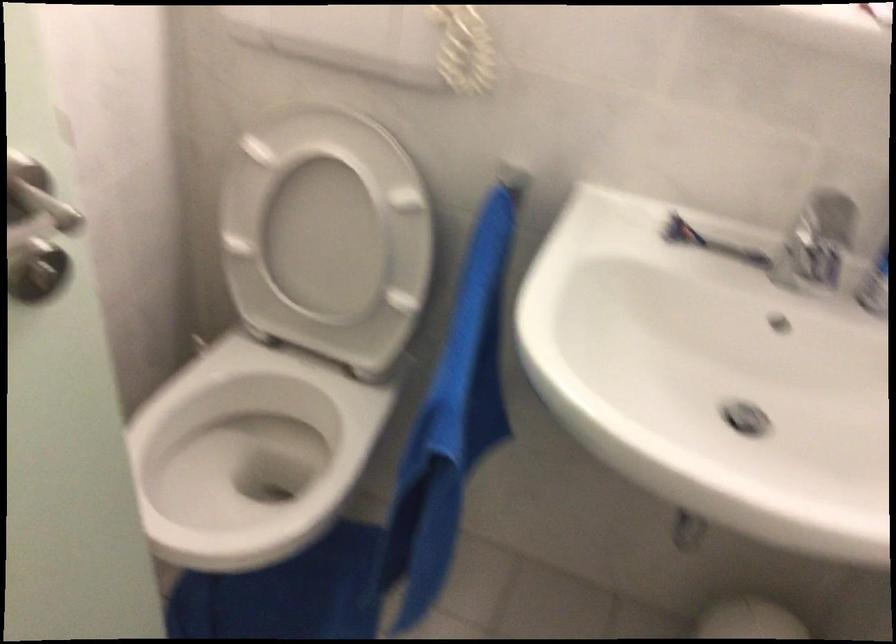
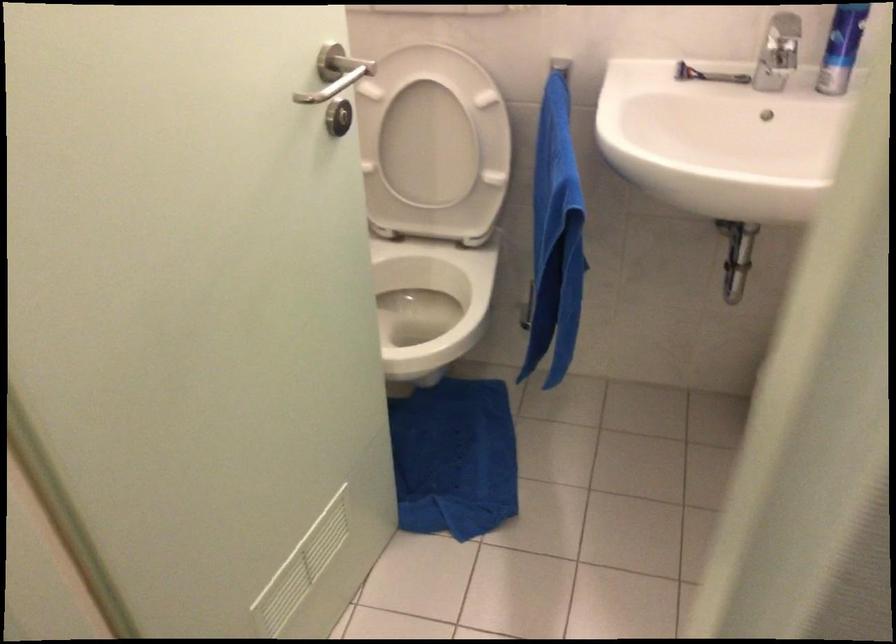
Question: How did the camera likely rotate?

Choices:
 (A) Left
 (B) Right
 (C) Up
 (D) Down

Answer: (C)